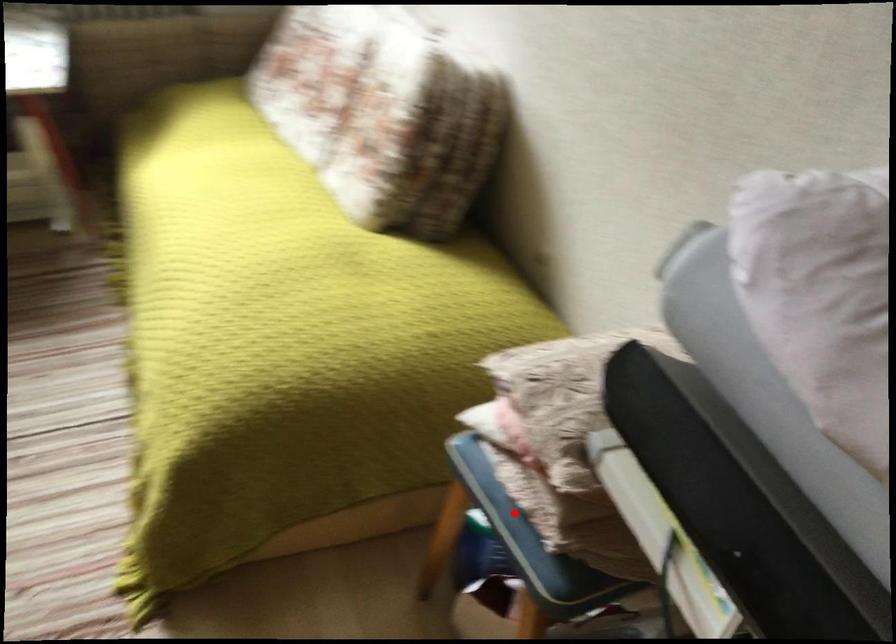
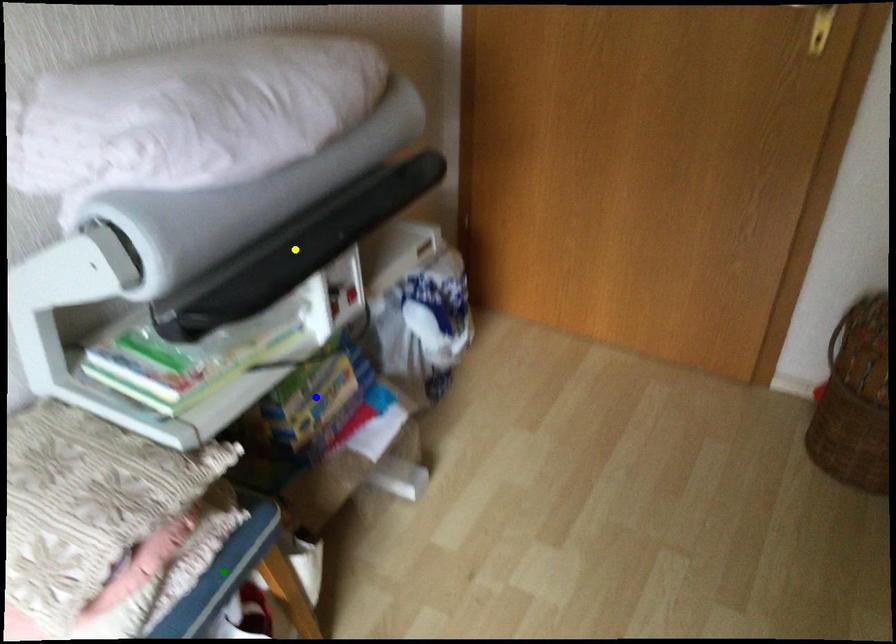
Question: I am providing you with two images of the same scene from different viewpoints. A red point is marked on the first image. You are given multiple points on the second image. Which point in image 2 is actually the same real-world point as the red point in image 1?

Choices:
 (A) green point
 (B) yellow point
 (C) blue point

Answer: (A)